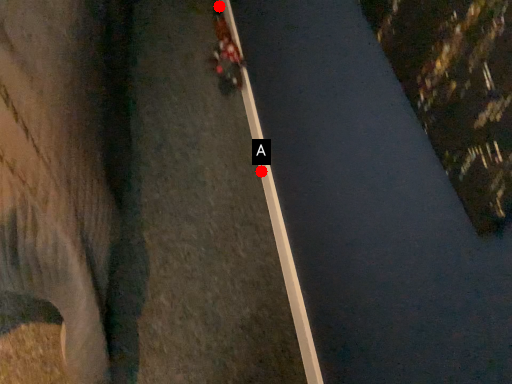
Question: Two points are circled on the image, labeled by A and B beside each circle. Which of the following is the closest to the observer?

Choices:
 (A) A is closer
 (B) B is closer

Answer: (A)